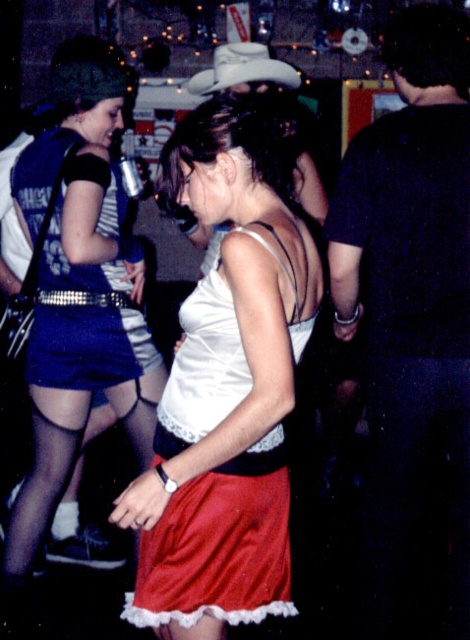
You are organizing a charity event and need to decide which outfit to wear. You have a white satin tank top at center and a matte black dress at center. Based on their widths, which one would you choose if you want an outfit that is wider?

The matte black dress at center is wider than the white satin tank top at center, so you should choose the matte black dress at center if you want a wider outfit.